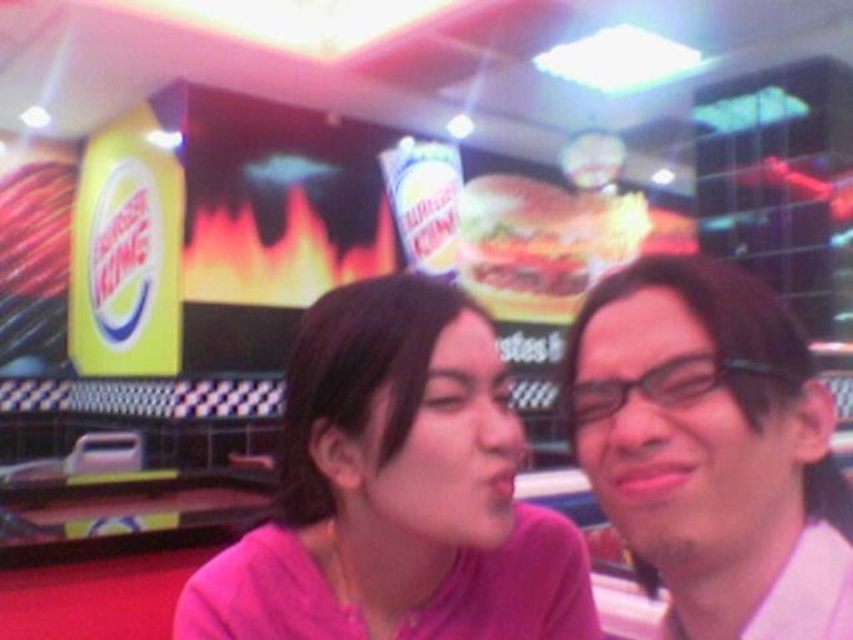
In the scene shown: You are a photographer setting up a shot in the Burger King scene. You need to ensure that the pink matte shirt at center and the matte white glasses at right are both in focus. Given their sizes, which object should you adjust your camera settings to prioritize focusing on first to ensure both are clear?

The pink matte shirt at center is wider than the matte white glasses at right. To ensure both are in focus, prioritize focusing on the pink matte shirt at center first since it is larger and requires more detailed focus, then adjust for the matte white glasses at right.

You are a photographer taking a photo of two people sitting at a table in a Burger King restaurant. You need to ensure that both the pink matte shirt at center and the matte white glasses at right are visible in the frame. Based on their positions, which object should be placed closer to the left side of the photo?

The pink matte shirt at center should be placed closer to the left side of the photo because it is to the left of the matte white glasses at right.

You are a photographer standing at the center of the Burger King restaurant scene. You notice two points marked in the image. Which point, point (173, 630) or point (608, 349), is closer to your camera lens?

Point (173, 630) is closer to the camera lens because it is further to the camera than point (608, 349).